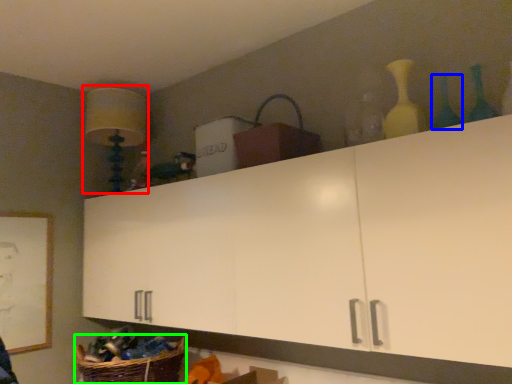
Question: Considering the real-world distances, which object is closest to lamp (highlighted by a red box)? bottle (highlighted by a blue box) or basket (highlighted by a green box).

Choices:
 (A) bottle
 (B) basket

Answer: (B)